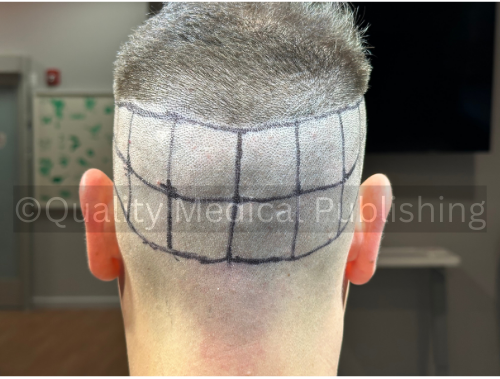
At what (x,y) coordinates should I click in order to perform the action: click on table. Please return your answer as a coordinate pair (x, y). Image resolution: width=500 pixels, height=379 pixels. Looking at the image, I should click on (426, 261).